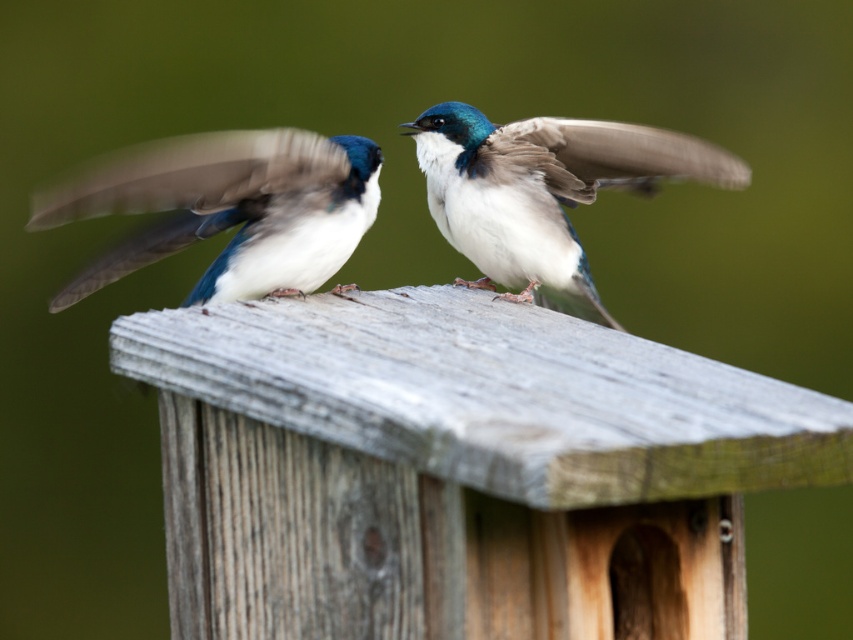
Question: Is white matte bird at center above smooth feathered wing at center?

Choices:
 (A) no
 (B) yes

Answer: (A)

Question: Which of these objects is positioned farthest from the white matte bird at center?

Choices:
 (A) shiny blue-green bird at center
 (B) smooth feathered wing at center

Answer: (B)

Question: Observing the image, what is the correct spatial positioning of shiny blue-green bird at center in reference to smooth feathered wing at center?

Choices:
 (A) right
 (B) left

Answer: (B)

Question: Estimate the real-world distances between objects in this image. Which object is farther from the shiny blue-green bird at center?

Choices:
 (A) white matte bird at center
 (B) smooth feathered wing at center

Answer: (A)

Question: Which point is closer to the camera?

Choices:
 (A) (592, 172)
 (B) (494, 241)

Answer: (B)

Question: Does white matte bird at center appear over shiny blue-green bird at center?

Choices:
 (A) yes
 (B) no

Answer: (A)